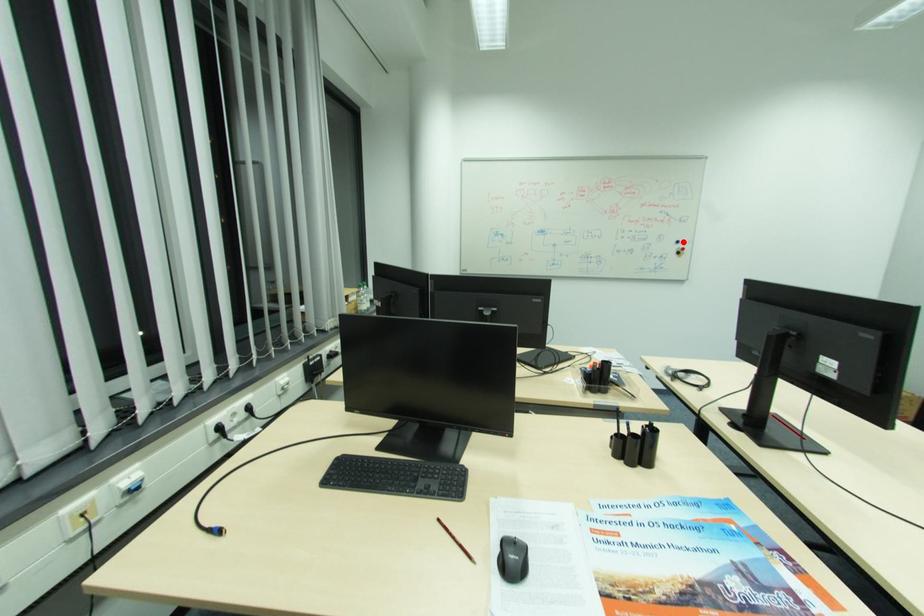
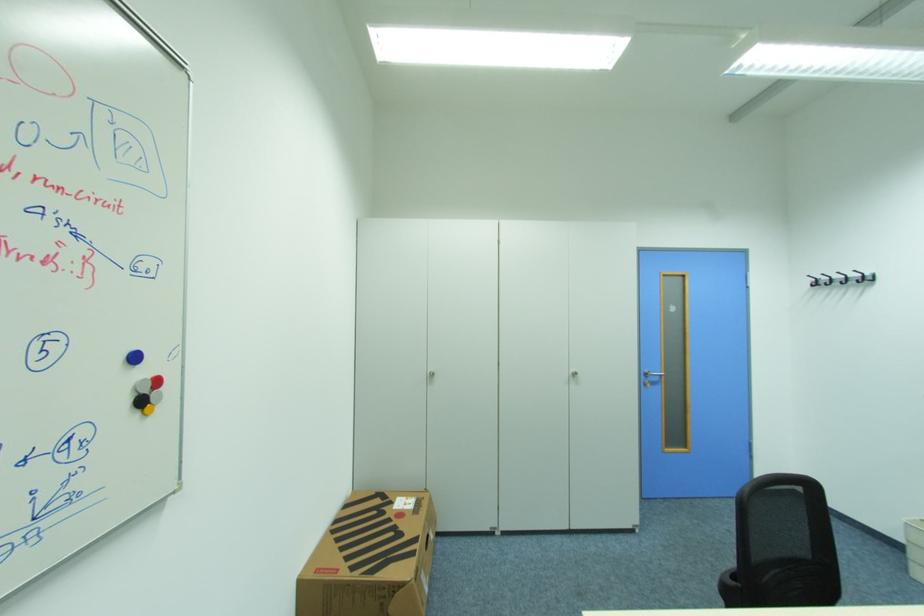
Where in the second image is the point corresponding to the highlighted location from the first image?

(140, 359)